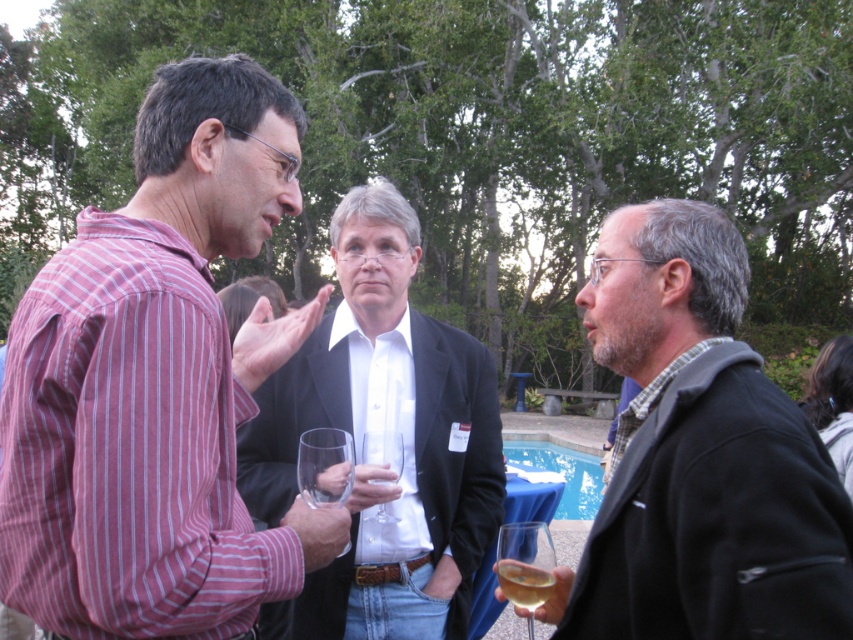
Question: Is white shirt at center to the left of clear glass wine glass at center from the viewer's perspective?

Choices:
 (A) no
 (B) yes

Answer: (A)

Question: Which of these objects is positioned farthest from the striped cotton shirt at left?

Choices:
 (A) translucent glass wine at lower right
 (B) translucent glass wine glass at lower right
 (C) white shirt at center

Answer: (B)

Question: Is gray wool jacket at right to the left of clear glass wine glass at center from the viewer's perspective?

Choices:
 (A) no
 (B) yes

Answer: (A)

Question: Is white shirt at center to the right of translucent glass wine glass at lower right from the viewer's perspective?

Choices:
 (A) yes
 (B) no

Answer: (B)

Question: Which object is closer to the camera taking this photo?

Choices:
 (A) striped cotton shirt at left
 (B) translucent glass wine at lower right
 (C) gray wool jacket at right

Answer: (C)

Question: Based on their relative distances, which object is farther from the striped cotton shirt at left?

Choices:
 (A) translucent glass wine glass at lower right
 (B) gray wool jacket at right

Answer: (B)